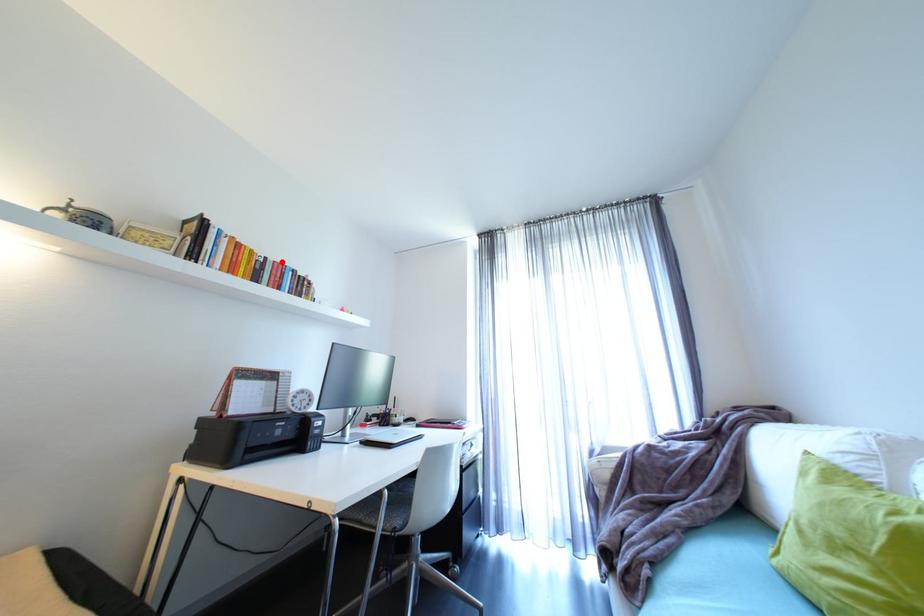
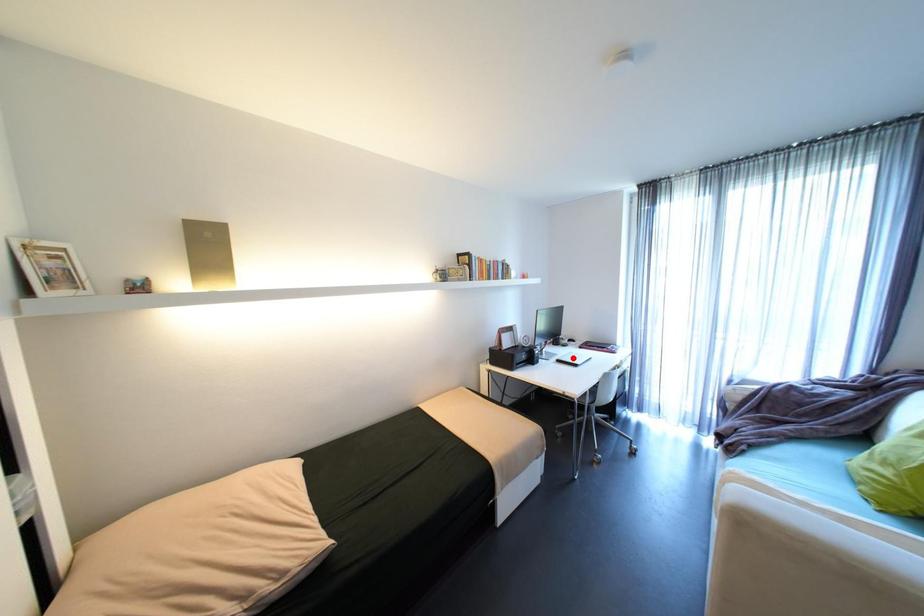
I am providing you with two images of the same scene from different viewpoints. A red point is marked on the first image and another point is marked on the second image. Do the highlighted points in image1 and image2 indicate the same real-world spot?

No